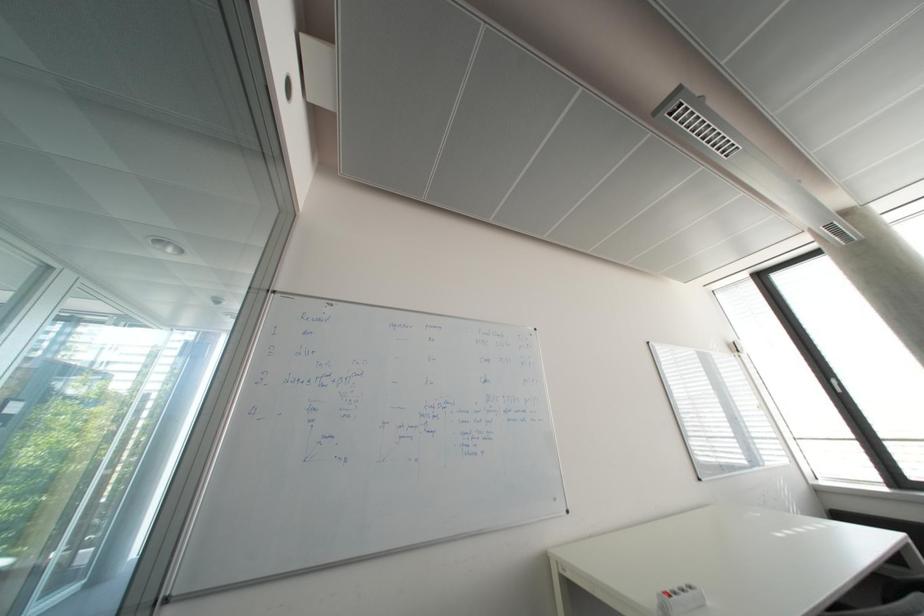
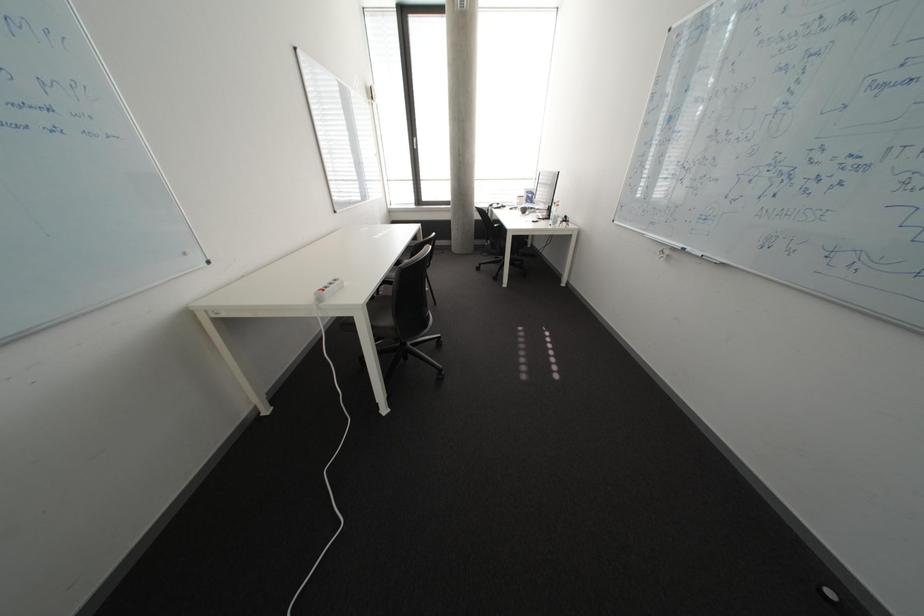
Based on the continuous images, in which direction is the camera rotating?

The camera's rotation is toward right-down.